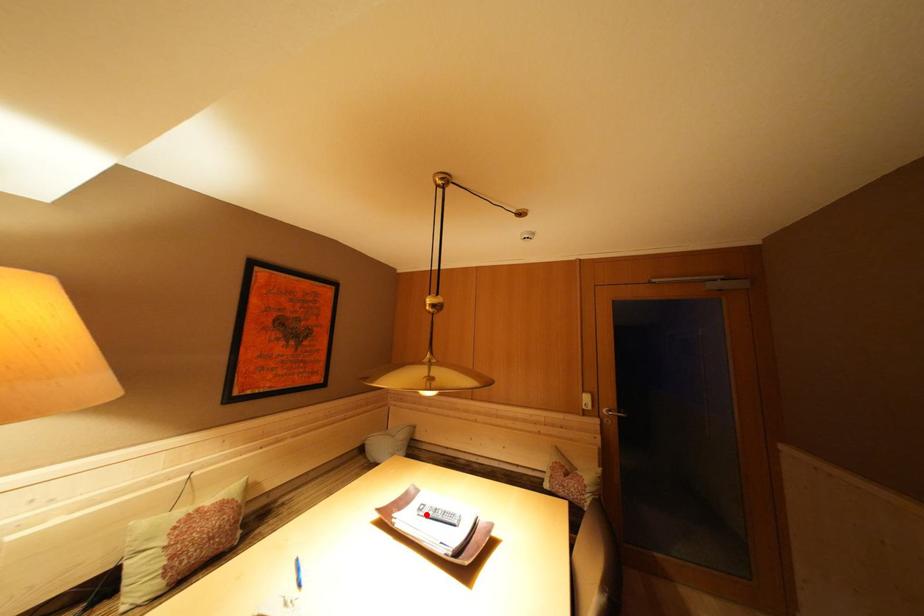
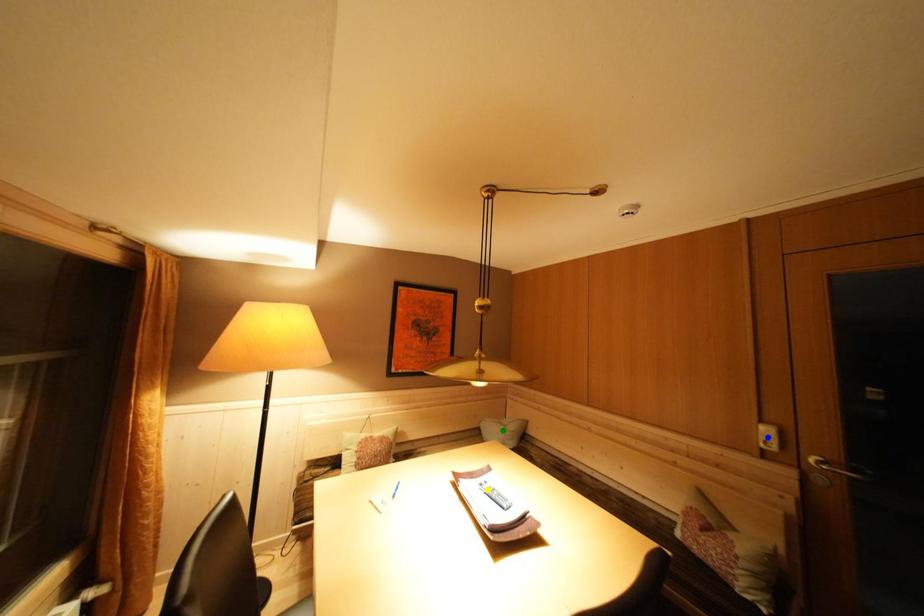
Question: I am providing you with two images of the same scene from different viewpoints. A red point is marked on the first image. You are given multiple points on the second image. Which spot in image 2 lines up with the point in image 1?

Choices:
 (A) blue point
 (B) green point
 (C) yellow point

Answer: (C)